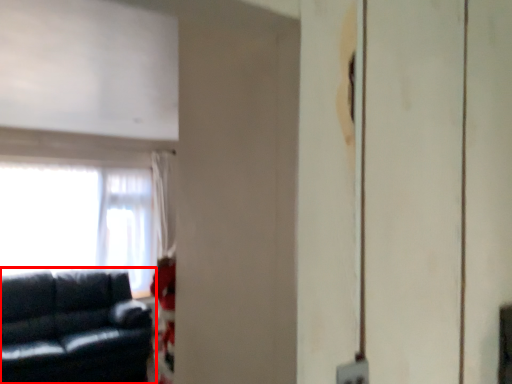
Question: From the image's perspective, where is studio couch (annotated by the red box) located relative to window?

Choices:
 (A) below
 (B) above

Answer: (A)